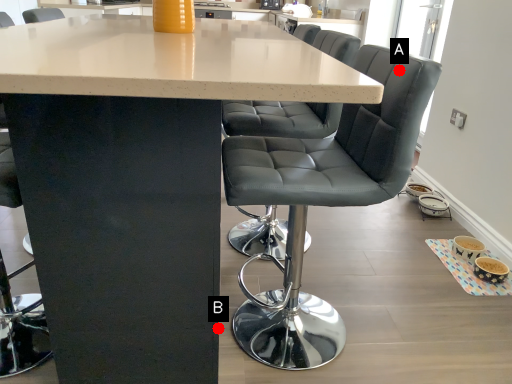
Question: Two points are circled on the image, labeled by A and B beside each circle. Which of the following is the closest to the observer?

Choices:
 (A) A is closer
 (B) B is closer

Answer: (A)